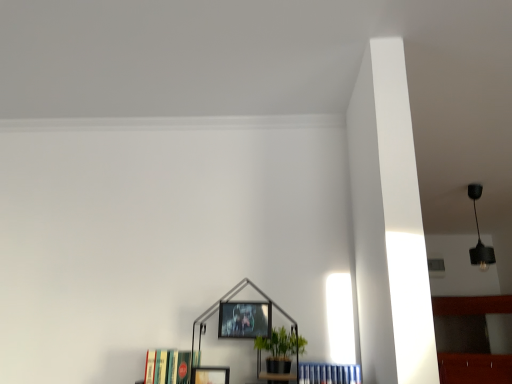
Question: From the image's perspective, relative to green matte plant at center, is metallic silver picture frame at center, positioned as the 1th picture frame in top-to-bottom order, above or below?

Choices:
 (A) below
 (B) above

Answer: (B)

Question: From a real-world perspective, relative to green matte plant at center, is metallic silver picture frame at center, which is the second picture frame in left-to-right order, vertically above or below?

Choices:
 (A) below
 (B) above

Answer: (B)

Question: Estimate the real-world distances between objects in this image. Which object is farther from the metallic silver picture frame at center, which is the second picture frame in left-to-right order?

Choices:
 (A) black matte pendant light at upper right
 (B) hardcover books at lower left, which is the 2th book from right to left
 (C) green matte plant at center
 (D) blue hardcover books at lower center, which ranks as the first book in right-to-left order
 (E) matte black picture frame at lower center, the second picture frame viewed from the top

Answer: (A)

Question: Based on their relative distances, which object is farther from the hardcover books at lower left, the first book when ordered from left to right?

Choices:
 (A) matte black picture frame at lower center, which is the first picture frame in left-to-right order
 (B) black matte pendant light at upper right
 (C) metallic silver picture frame at center, acting as the 2th picture frame starting from the bottom
 (D) blue hardcover books at lower center, marked as the second book in a left-to-right arrangement
 (E) green matte plant at center

Answer: (B)